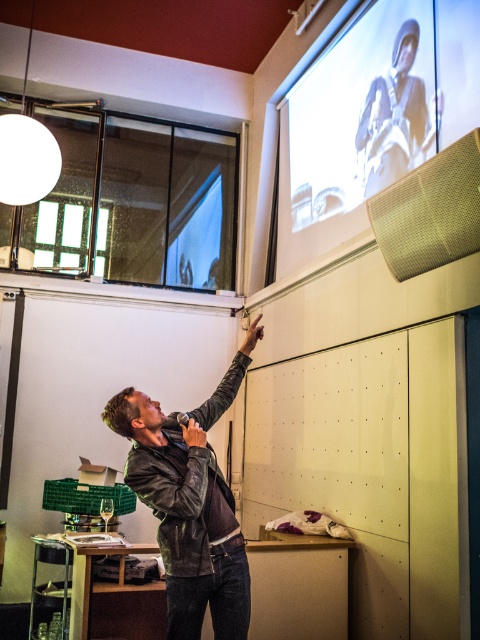
Question: Does white matte projection screen at upper right appear on the right side of leather jacket at center?

Choices:
 (A) no
 (B) yes

Answer: (B)

Question: Can you confirm if white matte projection screen at upper right is wider than leather jacket at center?

Choices:
 (A) no
 (B) yes

Answer: (B)

Question: Which object is closer to the camera taking this photo?

Choices:
 (A) leather jacket at center
 (B) white matte projection screen at upper right

Answer: (A)

Question: Which of the following is the farthest from the observer?

Choices:
 (A) (443, 61)
 (B) (210, 570)

Answer: (A)

Question: Which of the following is the farthest from the observer?

Choices:
 (A) (144, 420)
 (B) (420, 118)

Answer: (B)

Question: Is white matte projection screen at upper right wider than leather jacket at center?

Choices:
 (A) yes
 (B) no

Answer: (A)